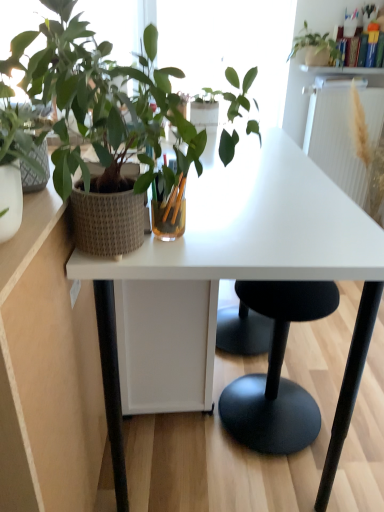
Question: From the image's perspective, does white matte desk at center appear lower than white textured radiator at upper right?

Choices:
 (A) no
 (B) yes

Answer: (B)

Question: Considering the relative positions of white matte desk at center and white textured radiator at upper right in the image provided, is white matte desk at center in front of white textured radiator at upper right?

Choices:
 (A) no
 (B) yes

Answer: (B)

Question: Considering the relative sizes of white matte desk at center and white textured radiator at upper right in the image provided, is white matte desk at center taller than white textured radiator at upper right?

Choices:
 (A) no
 (B) yes

Answer: (A)

Question: Considering the relative sizes of white matte desk at center and white textured radiator at upper right in the image provided, is white matte desk at center bigger than white textured radiator at upper right?

Choices:
 (A) no
 (B) yes

Answer: (B)

Question: Is white matte desk at center smaller than white textured radiator at upper right?

Choices:
 (A) no
 (B) yes

Answer: (A)

Question: Considering the positions of white matte desk at center and white textured radiator at upper right in the image, is white matte desk at center wider or thinner than white textured radiator at upper right?

Choices:
 (A) thin
 (B) wide

Answer: (B)

Question: Is point (221, 262) positioned closer to the camera than point (339, 178)?

Choices:
 (A) closer
 (B) farther

Answer: (A)

Question: Is white matte desk at center bigger or smaller than white textured radiator at upper right?

Choices:
 (A) big
 (B) small

Answer: (A)

Question: From a real-world perspective, relative to white textured radiator at upper right, is white matte desk at center vertically above or below?

Choices:
 (A) above
 (B) below

Answer: (B)

Question: From the image's perspective, is textured woven pot at left, the 1th houseplant when ordered from bottom to top, above or below white glossy shelf at upper center?

Choices:
 (A) above
 (B) below

Answer: (B)

Question: Is textured woven pot at left, placed as the 1th houseplant when sorted from left to right, inside or outside of white glossy shelf at upper center?

Choices:
 (A) inside
 (B) outside

Answer: (B)

Question: Considering the positions of textured woven pot at left, the 2th houseplant viewed from the top, and white glossy shelf at upper center in the image, is textured woven pot at left, the 2th houseplant viewed from the top, wider or thinner than white glossy shelf at upper center?

Choices:
 (A) thin
 (B) wide

Answer: (B)

Question: In terms of height, does textured woven pot at left, the 1th houseplant when ordered from bottom to top, look taller or shorter compared to white glossy shelf at upper center?

Choices:
 (A) short
 (B) tall

Answer: (B)

Question: Is matte white pot at upper right, placed as the first houseplant when sorted from right to left, bigger or smaller than textured woven pot at left, acting as the 2th houseplant starting from the back?

Choices:
 (A) small
 (B) big

Answer: (A)

Question: Would you say matte white pot at upper right, which is counted as the second houseplant, starting from the bottom, is inside or outside textured woven pot at left, arranged as the 1th houseplant when viewed from the front?

Choices:
 (A) outside
 (B) inside

Answer: (A)